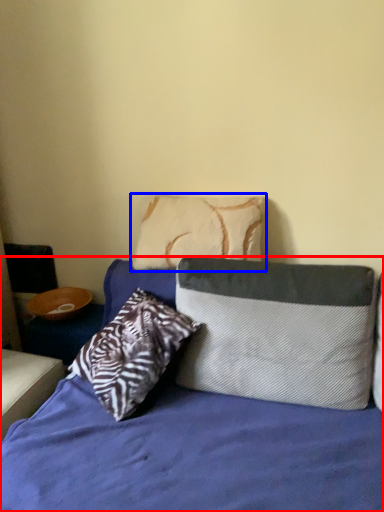
Question: Which point is further to the camera, bed (highlighted by a red box) or pillow (highlighted by a blue box)?

Choices:
 (A) bed
 (B) pillow

Answer: (B)